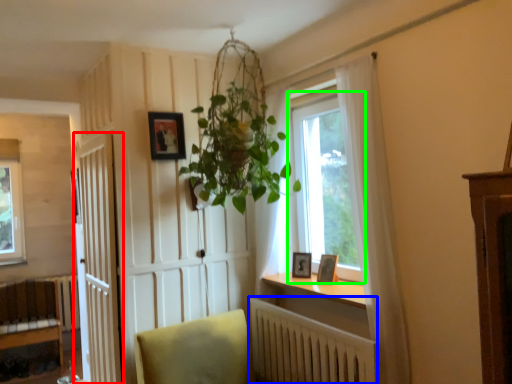
Question: Based on their relative distances, which object is nearer to door (highlighted by a red box)? Choose from radiator (highlighted by a blue box) and window (highlighted by a green box).

Choices:
 (A) radiator
 (B) window

Answer: (A)